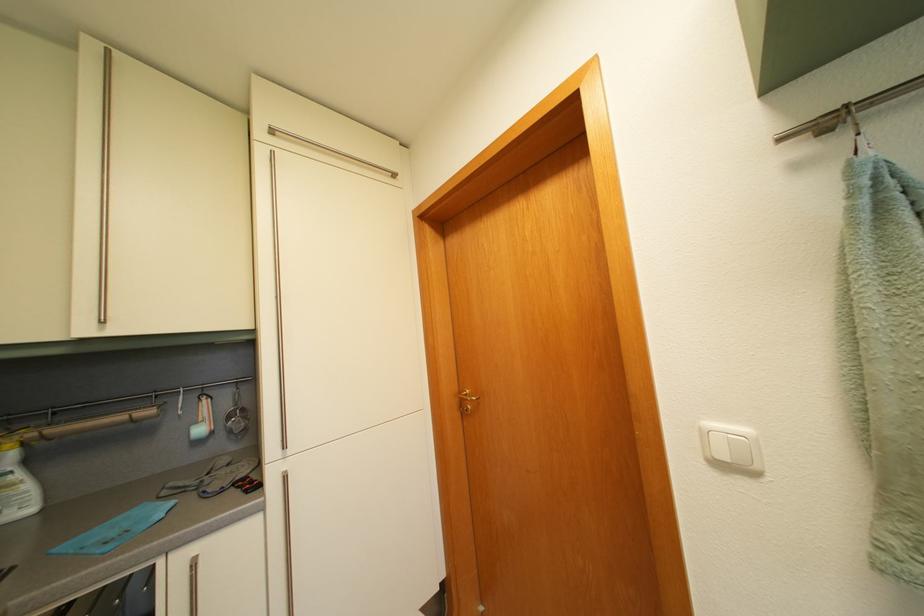
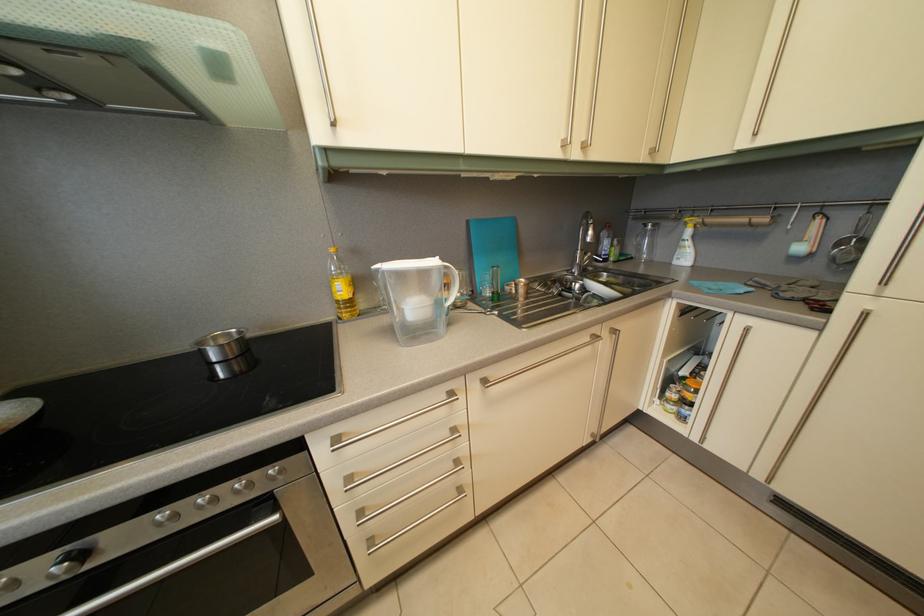
Where in the second image is the point corresponding to (204,430) from the first image?

(808, 248)